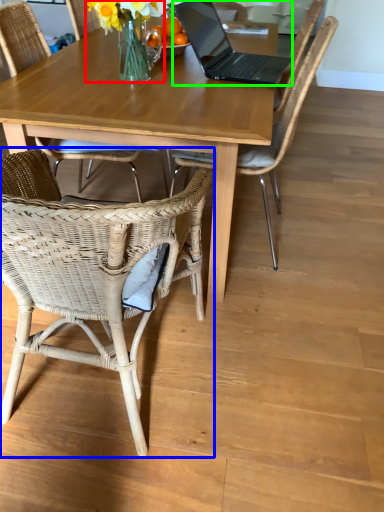
Question: Considering the real-world distances, which object is farthest from floral arrangement (highlighted by a red box)? chair (highlighted by a blue box) or laptop (highlighted by a green box)?

Choices:
 (A) chair
 (B) laptop

Answer: (A)